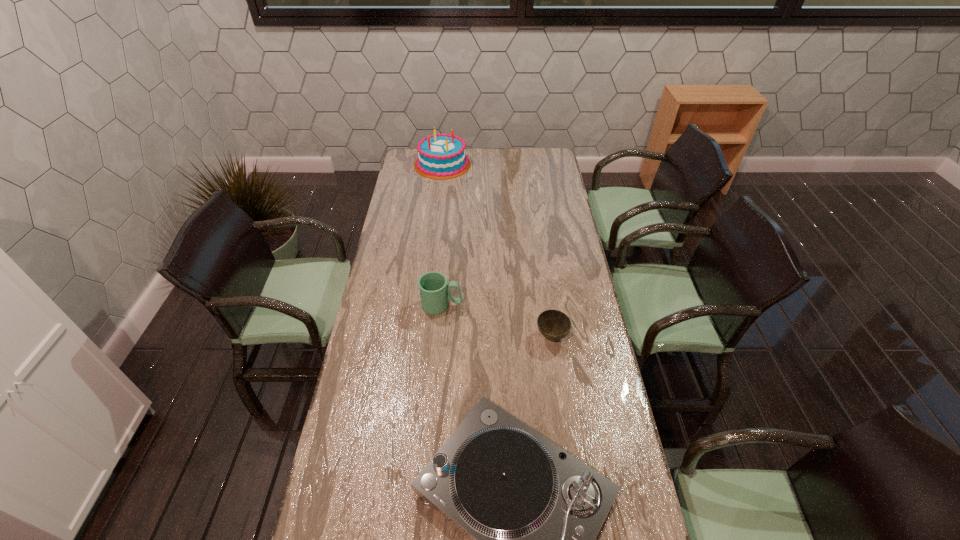
Locate an element on the screen. object that is at the left edge is located at coordinates (442, 156).

Where is `object located in the right edge section of the desktop`? This screenshot has width=960, height=540. object located in the right edge section of the desktop is located at coordinates (554, 325).

Find the location of `object present at the far left corner`. object present at the far left corner is located at coordinates (442, 156).

Where is `free space at the far edge of the desktop`? The height and width of the screenshot is (540, 960). free space at the far edge of the desktop is located at coordinates click(x=483, y=164).

You are a GUI agent. You are given a task and a screenshot of the screen. Output one action in this format:
    pyautogui.click(x=<x>, y=<y>)
    Task: Click on the vacant point at the left edge
    Image resolution: width=960 pixels, height=540 pixels.
    Given the screenshot: What is the action you would take?
    pyautogui.click(x=402, y=268)

This screenshot has width=960, height=540. I want to click on vacant point at the right edge, so click(x=623, y=500).

The height and width of the screenshot is (540, 960). I want to click on vacant space at the far right corner of the desktop, so click(x=540, y=157).

You are a GUI agent. You are given a task and a screenshot of the screen. Output one action in this format:
    pyautogui.click(x=<x>, y=<y>)
    Task: Click on the unoccupied position between the mug and the shortest object
    Image resolution: width=960 pixels, height=540 pixels.
    Given the screenshot: What is the action you would take?
    pyautogui.click(x=496, y=321)

Identify the location of empty space that is in between the mug and the farthest object. (443, 235).

The image size is (960, 540). What are the coordinates of `blank region between the shortest object and the third nearest object` in the screenshot? It's located at (496, 321).